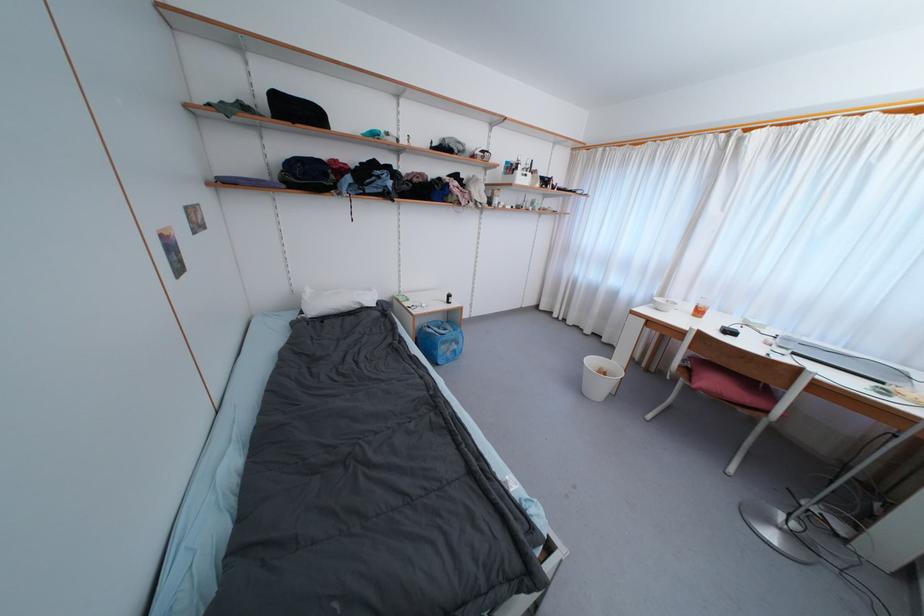
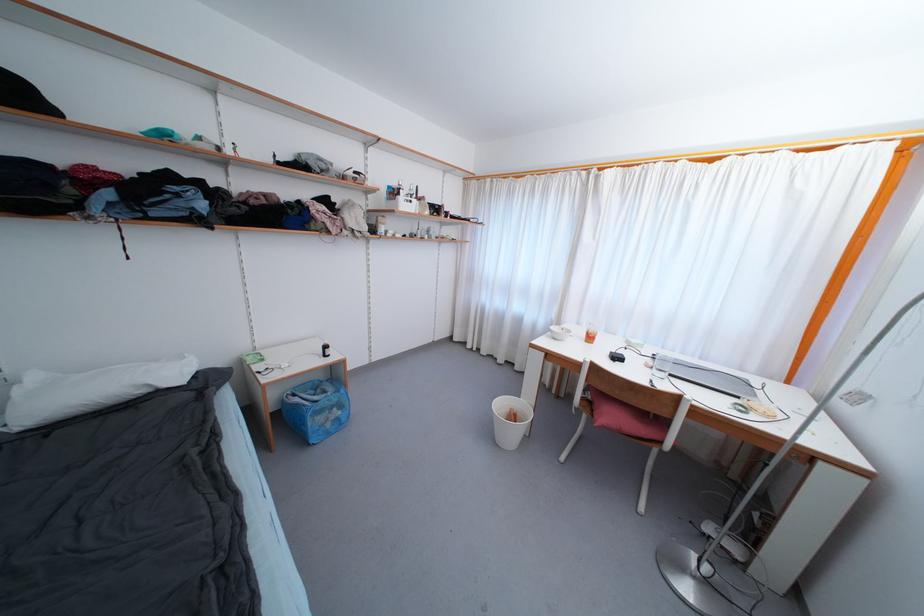
The point at (596, 363) is marked in the first image. Where is the corresponding point in the second image?

(505, 407)